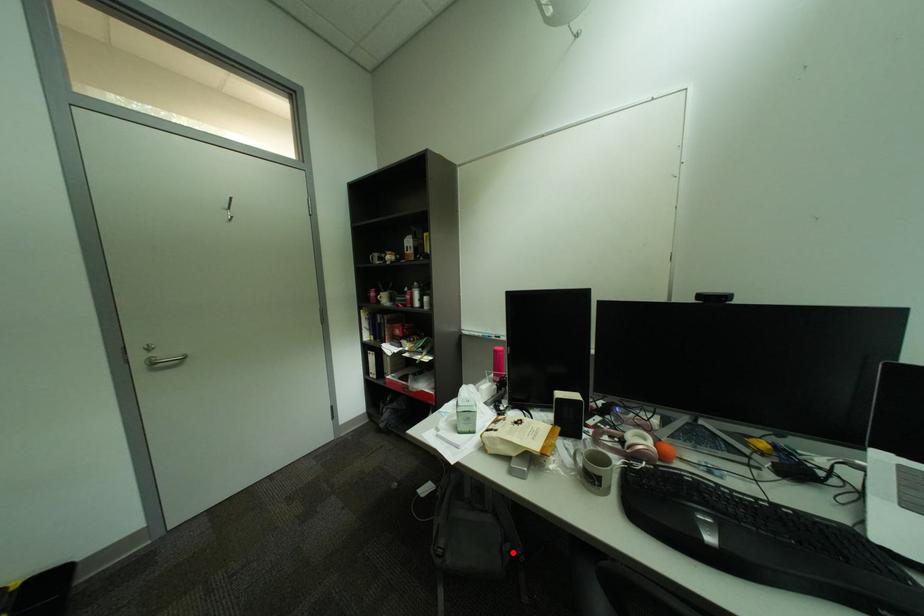
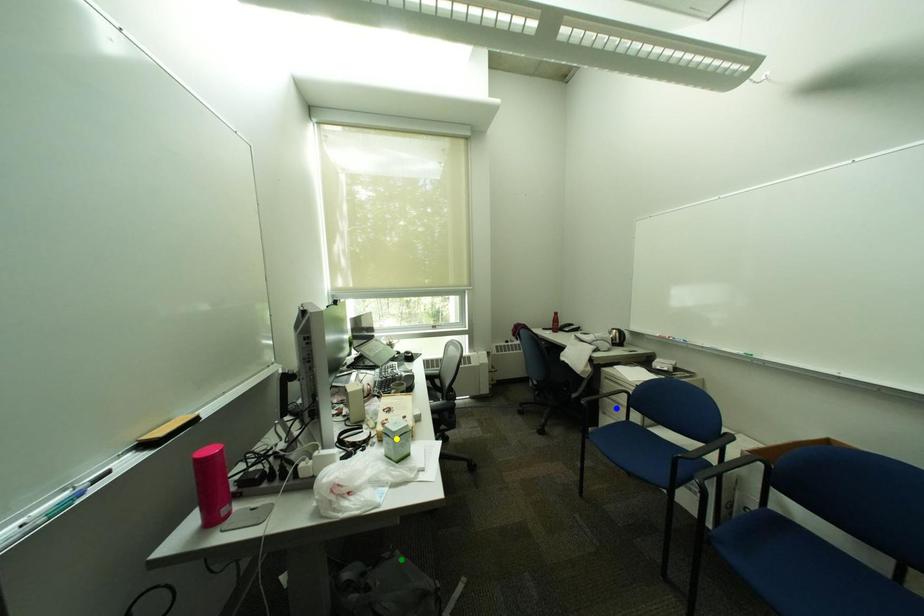
Question: I am providing you with two images of the same scene from different viewpoints. A red point is marked on the first image. You are given multiple points on the second image. Which point in image 2 represents the same 3d spot as the red point in image 1?

Choices:
 (A) yellow point
 (B) blue point
 (C) green point

Answer: (C)